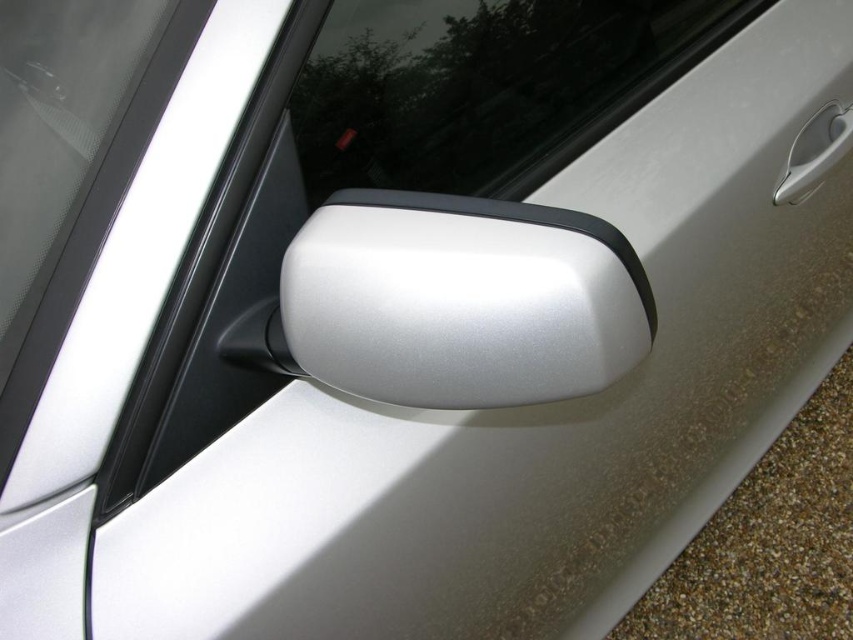
Can you confirm if transparent glass at upper center is positioned above satin silver door handle at upper right?

Indeed, transparent glass at upper center is positioned over satin silver door handle at upper right.

Does point (576, 42) come farther from viewer compared to point (810, 188)?

No, it is in front of (810, 188).

Between point (341, 83) and point (811, 131), which one is positioned behind?

Point (811, 131)

At what (x,y) coordinates should I click in order to perform the action: click on transparent glass at upper center. Please return your answer as a coordinate pair (x, y). The height and width of the screenshot is (640, 853). Looking at the image, I should click on (486, 86).

Can you confirm if satin silver side mirror at center is smaller than satin silver door handle at upper right?

No, satin silver side mirror at center is not smaller than satin silver door handle at upper right.

Locate an element on the screen. satin silver side mirror at center is located at coordinates (460, 300).

This screenshot has width=853, height=640. Find the location of `satin silver side mirror at center`. satin silver side mirror at center is located at coordinates (460, 300).

Does satin silver side mirror at center appear on the left side of transparent glass at upper center?

Yes, satin silver side mirror at center is to the left of transparent glass at upper center.

This screenshot has height=640, width=853. Find the location of `satin silver side mirror at center`. satin silver side mirror at center is located at coordinates (460, 300).